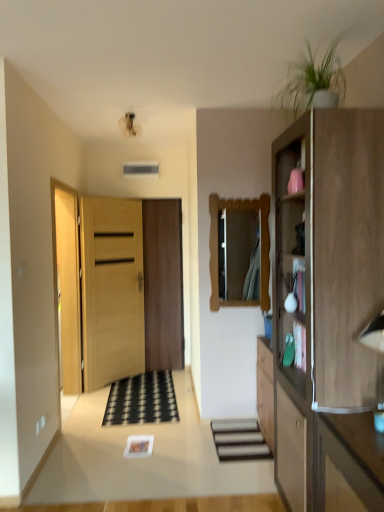
Question: Does light brown wood cabinet at right have a greater width compared to smooth wooden stairs at center?

Choices:
 (A) yes
 (B) no

Answer: (A)

Question: Is light brown wood cabinet at right directly adjacent to smooth wooden stairs at center?

Choices:
 (A) no
 (B) yes

Answer: (A)

Question: Considering the relative positions of light brown wood cabinet at right and smooth wooden stairs at center in the image provided, is light brown wood cabinet at right to the right of smooth wooden stairs at center from the viewer's perspective?

Choices:
 (A) no
 (B) yes

Answer: (B)

Question: Is light brown wood cabinet at right aimed at smooth wooden stairs at center?

Choices:
 (A) yes
 (B) no

Answer: (B)

Question: Is light brown wood cabinet at right thinner than smooth wooden stairs at center?

Choices:
 (A) yes
 (B) no

Answer: (B)

Question: Is light brown wood cabinet at right to the left or to the right of wooden door at center, arranged as the 2th door when viewed from the back, in the image?

Choices:
 (A) left
 (B) right

Answer: (B)

Question: From the image's perspective, is light brown wood cabinet at right positioned above or below wooden door at center, arranged as the 2th door when viewed from the back?

Choices:
 (A) above
 (B) below

Answer: (A)

Question: From a real-world perspective, is light brown wood cabinet at right positioned above or below wooden door at center, arranged as the 2th door when viewed from the back?

Choices:
 (A) below
 (B) above

Answer: (B)

Question: Is light brown wood cabinet at right in front of or behind wooden door at center, arranged as the 2th door when viewed from the back, in the image?

Choices:
 (A) front
 (B) behind

Answer: (A)

Question: Do you think black rubber doormat at center is within green matte plant at upper right, or outside of it?

Choices:
 (A) outside
 (B) inside

Answer: (A)

Question: From the image's perspective, is black rubber doormat at center above or below green matte plant at upper right?

Choices:
 (A) below
 (B) above

Answer: (A)

Question: In terms of size, does black rubber doormat at center appear bigger or smaller than green matte plant at upper right?

Choices:
 (A) big
 (B) small

Answer: (B)

Question: Considering their positions, is black rubber doormat at center located in front of or behind green matte plant at upper right?

Choices:
 (A) front
 (B) behind

Answer: (B)

Question: Is light brown wood cabinet at right to the left or to the right of wooden door at center, placed as the 1th door when sorted from back to front, in the image?

Choices:
 (A) left
 (B) right

Answer: (B)

Question: Is point (312, 485) closer or farther from the camera than point (152, 295)?

Choices:
 (A) farther
 (B) closer

Answer: (B)